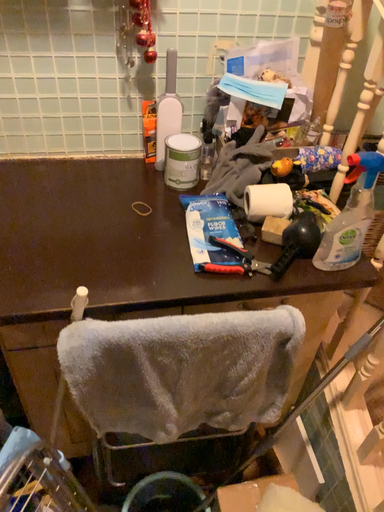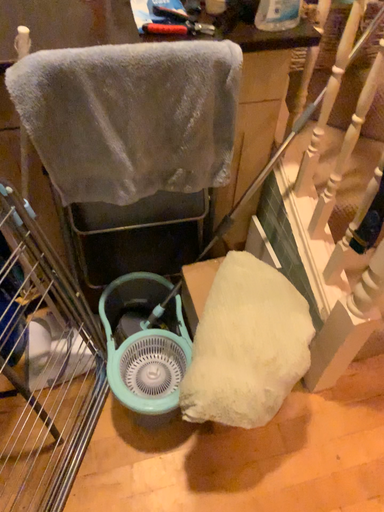
Question: Which way did the camera rotate in the video?

Choices:
 (A) rotated downward
 (B) rotated upward

Answer: (A)